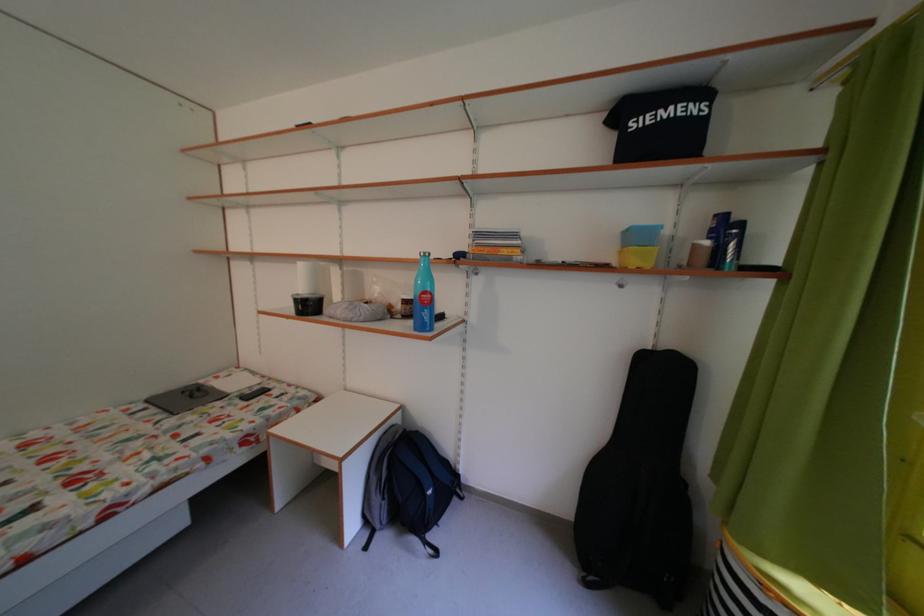
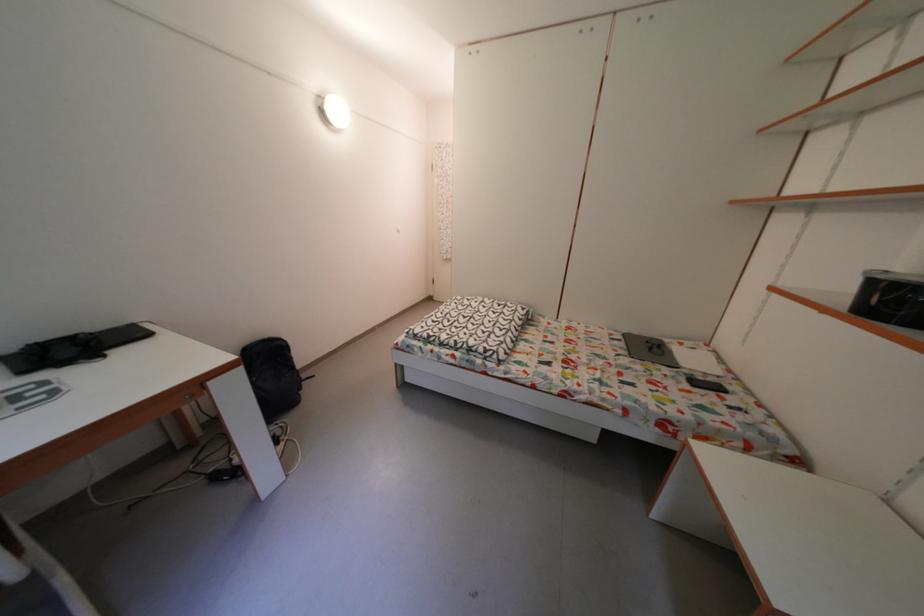
In the second image, find the point that corresponds to the point at 265,394 in the first image.

(721, 385)